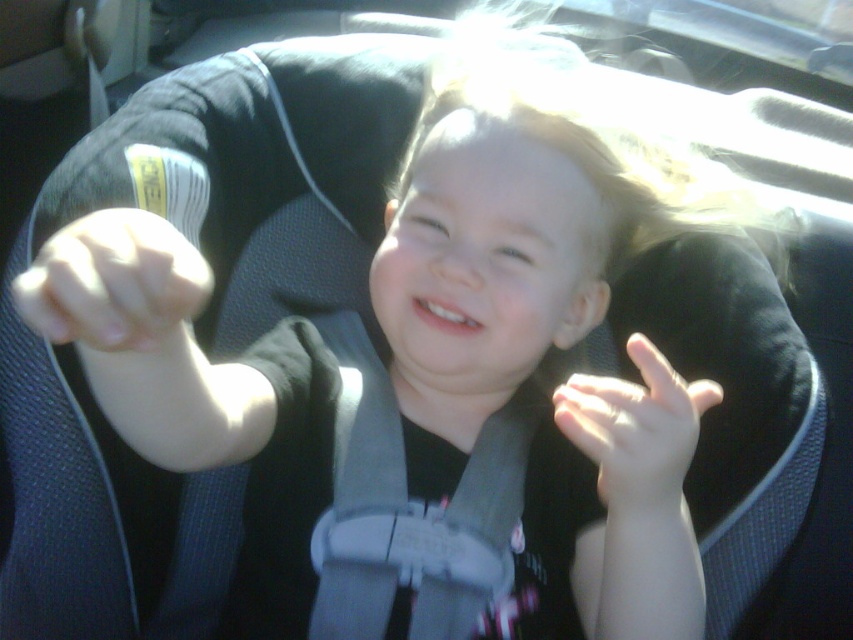
Does gray fabric strap at center have a greater width compared to white matte hand at center?

Yes, gray fabric strap at center is wider than white matte hand at center.

Who is positioned more to the left, gray fabric strap at center or white matte hand at center?

From the viewer's perspective, gray fabric strap at center appears more on the left side.

Where is `gray fabric strap at center`? gray fabric strap at center is located at coordinates (410, 513).

The height and width of the screenshot is (640, 853). Find the location of `gray fabric strap at center`. gray fabric strap at center is located at coordinates point(410,513).

Who is lower down, gray fabric strap at center or pale skin/flesh at center?

gray fabric strap at center is lower down.

Does gray fabric strap at center have a lesser width compared to pale skin/flesh at center?

Incorrect, gray fabric strap at center's width is not less than pale skin/flesh at center's.

What do you see at coordinates (410, 513) in the screenshot? Image resolution: width=853 pixels, height=640 pixels. I see `gray fabric strap at center` at bounding box center [410, 513].

Locate an element on the screen. This screenshot has width=853, height=640. gray fabric strap at center is located at coordinates (410, 513).

Consider the image. Is pale skin/flesh at center wider than white matte hand at center?

No, pale skin/flesh at center is not wider than white matte hand at center.

Is point (36, 301) farther from viewer compared to point (657, 493)?

No.

Who is more distant from viewer, (56, 305) or (624, 467)?

The point (624, 467) is behind.

I want to click on pale skin/flesh at center, so click(x=113, y=282).